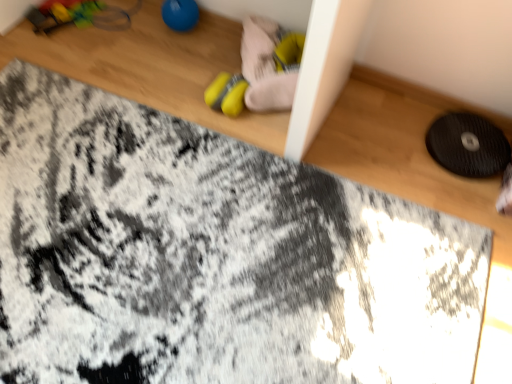
Question: From the image's perspective, relative to black textured mat at right, is blue rubber ball at upper center, arranged as the 2th toy when viewed from the right, above or below?

Choices:
 (A) above
 (B) below

Answer: (A)

Question: Considering their positions, is blue rubber ball at upper center, the first toy in the left-to-right sequence, located in front of or behind black textured mat at right?

Choices:
 (A) front
 (B) behind

Answer: (B)

Question: Which object is the farthest from the blue rubber ball at upper center, the first toy in the left-to-right sequence?

Choices:
 (A) yellow fabric shoe at upper center
 (B) yellow rubber toy at center, arranged as the first toy when viewed from the right
 (C) black textured mat at right

Answer: (C)

Question: Based on their relative distances, which object is nearer to the yellow rubber toy at center, arranged as the first toy when viewed from the right?

Choices:
 (A) blue rubber ball at upper center, arranged as the 2th toy when viewed from the right
 (B) black textured mat at right
 (C) yellow fabric shoe at upper center

Answer: (C)